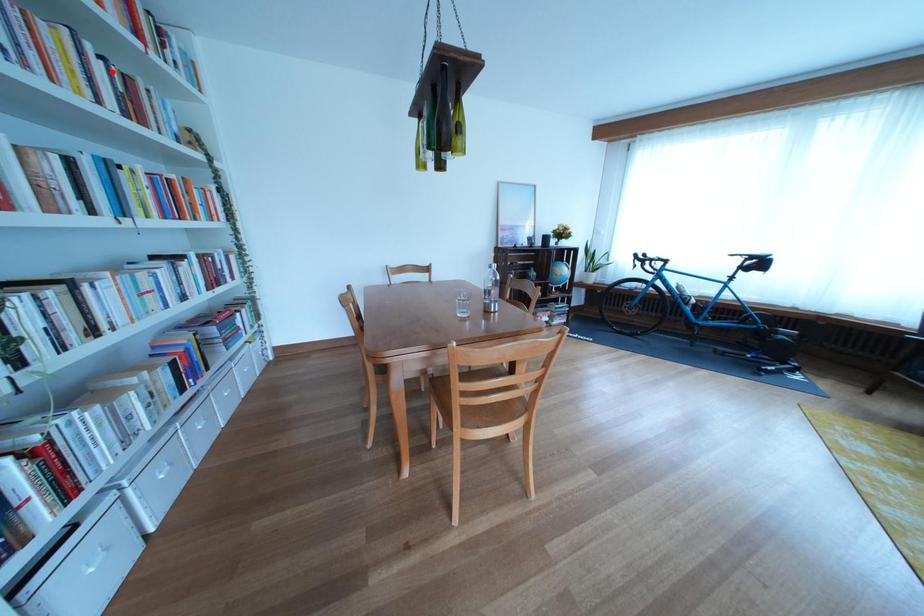
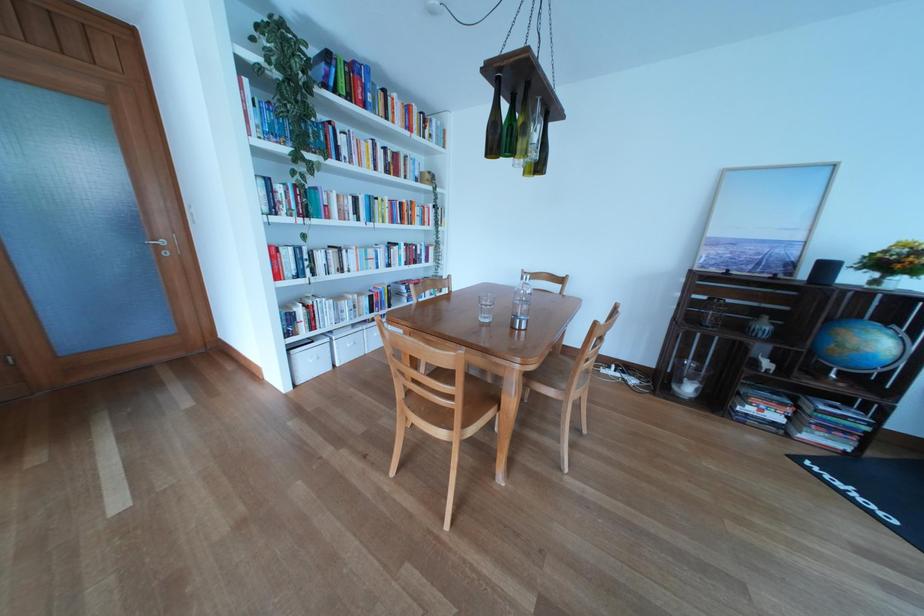
Locate, in the second image, the point that corresponds to the highlighted location in the first image.

(394, 159)